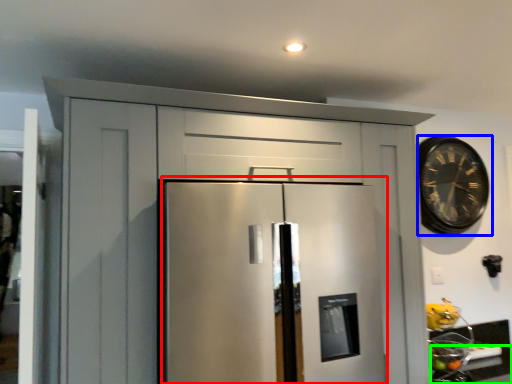
Question: Which object is positioned farthest from appliance (highlighted by a red box)? Select from clock (highlighted by a blue box) and counter top (highlighted by a green box).

Choices:
 (A) clock
 (B) counter top

Answer: (A)